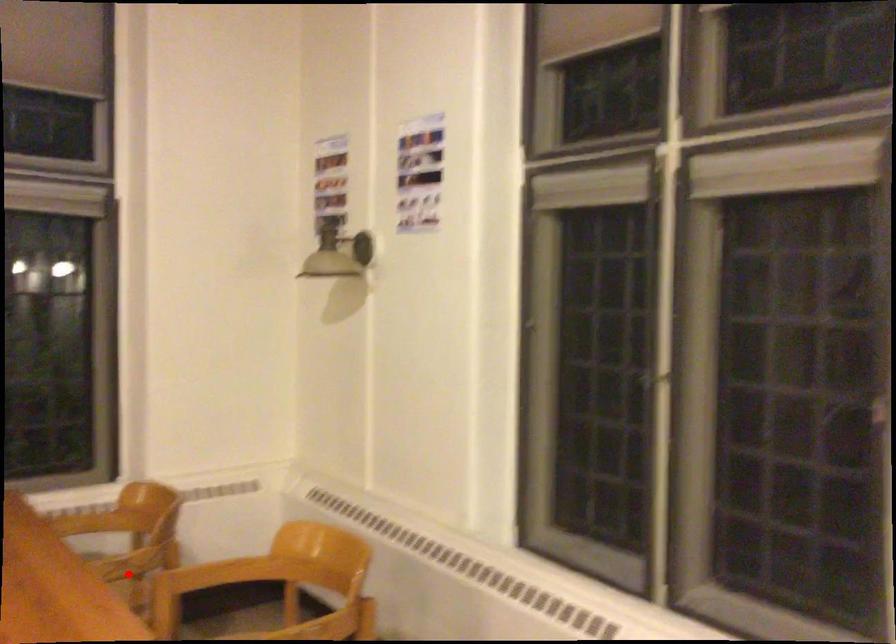
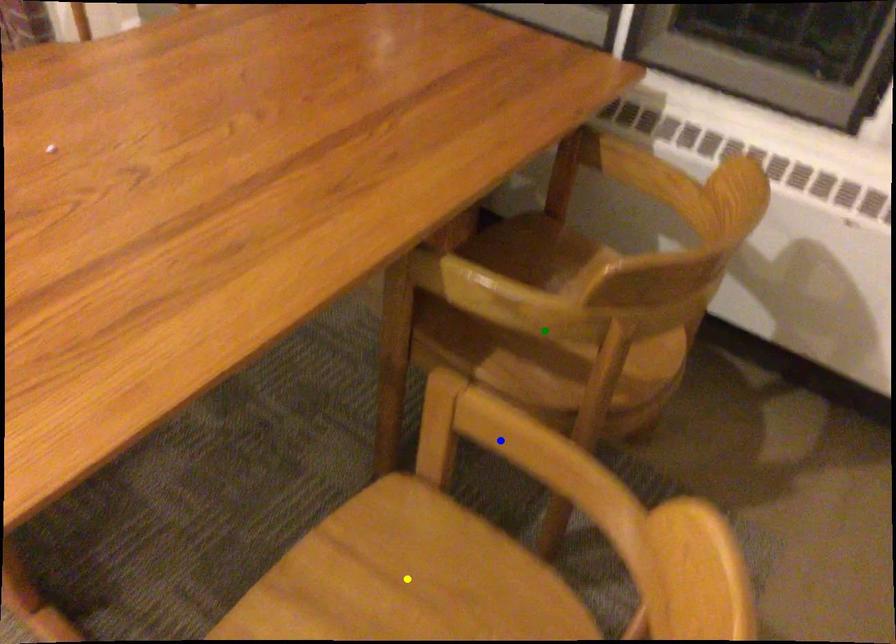
Question: I am providing you with two images of the same scene from different viewpoints. A red point is marked on the first image. You are given multiple points on the second image. Which mark in image 2 goes with the point in image 1?

Choices:
 (A) green point
 (B) blue point
 (C) yellow point

Answer: (A)